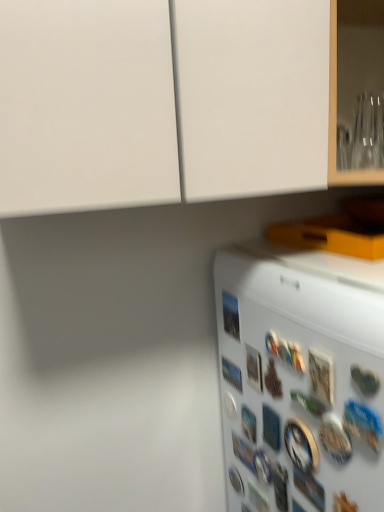
Question: Do you think metallic silver button at lower right, which is the tenth button in back-to-front order, is within metallic silver button at lower right, the 11th button in the back-to-front sequence, or outside of it?

Choices:
 (A) outside
 (B) inside

Answer: (A)

Question: From the image's perspective, is metallic silver button at lower right, which is the tenth button in back-to-front order, positioned above or below metallic silver button at lower right, the 11th button in the back-to-front sequence?

Choices:
 (A) above
 (B) below

Answer: (B)

Question: Estimate the real-world distances between objects in this image. Which object is farther from the blue glossy button at lower right, placed as the 1th button when sorted from front to back?

Choices:
 (A) metallic blue magnet at lower center, which is the 4th button from back to front
 (B) metallic photo at right, the seventh button from the back
 (C) blue plastic button at lower right, the 9th button in the back-to-front sequence
 (D) blue glossy button at lower center, the sixth button positioned from the back
 (E) metallic silver button at lower right, the 3th button from the front

Answer: (A)

Question: Considering the real-world distances, which object is closest to the blue glossy button at lower right, placed as the 1th button when sorted from front to back?

Choices:
 (A) blue plastic button at lower right, the 9th button in the back-to-front sequence
 (B) white plastic button at lower center, which is the second button in back-to-front order
 (C) metallic silver button at lower right, the twelfth button in the back-to-front sequence
 (D) white plastic button at lower right, which is the fifth button from back to front
 (E) metallic silver button at lower center, which appears as the first button when viewed from the back

Answer: (C)